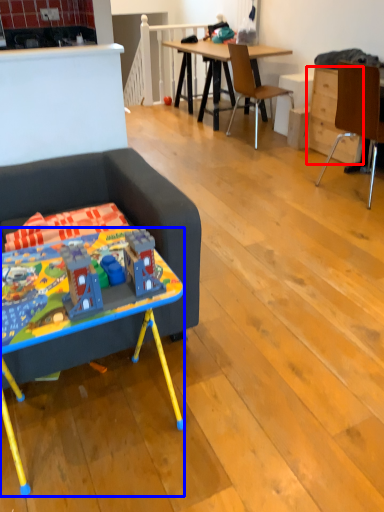
Question: Among these objects, which one is farthest to the camera, drawer (highlighted by a red box) or desk (highlighted by a blue box)?

Choices:
 (A) drawer
 (B) desk

Answer: (A)